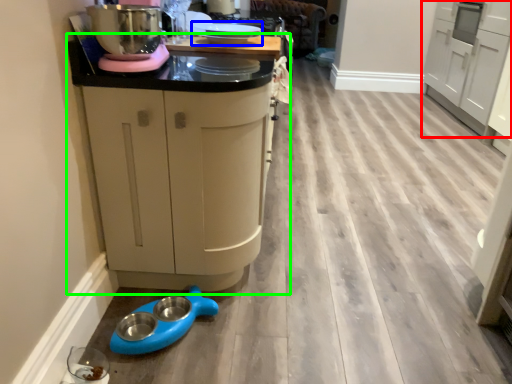
Question: Based on their relative distances, which object is farther from cabinetry (highlighted by a red box)? Choose from appliance (highlighted by a blue box) and cabinetry (highlighted by a green box).

Choices:
 (A) appliance
 (B) cabinetry

Answer: (B)